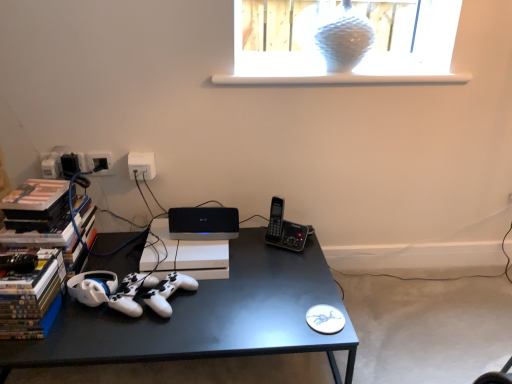
This screenshot has height=384, width=512. In order to click on empty space that is ontop of white matte window sill at upper center in this screenshot , I will do `click(389, 66)`.